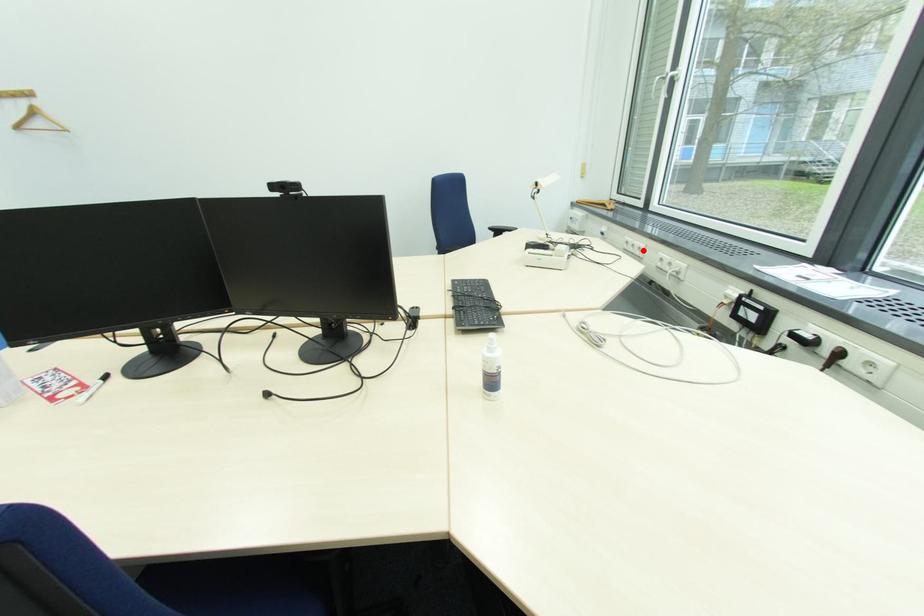
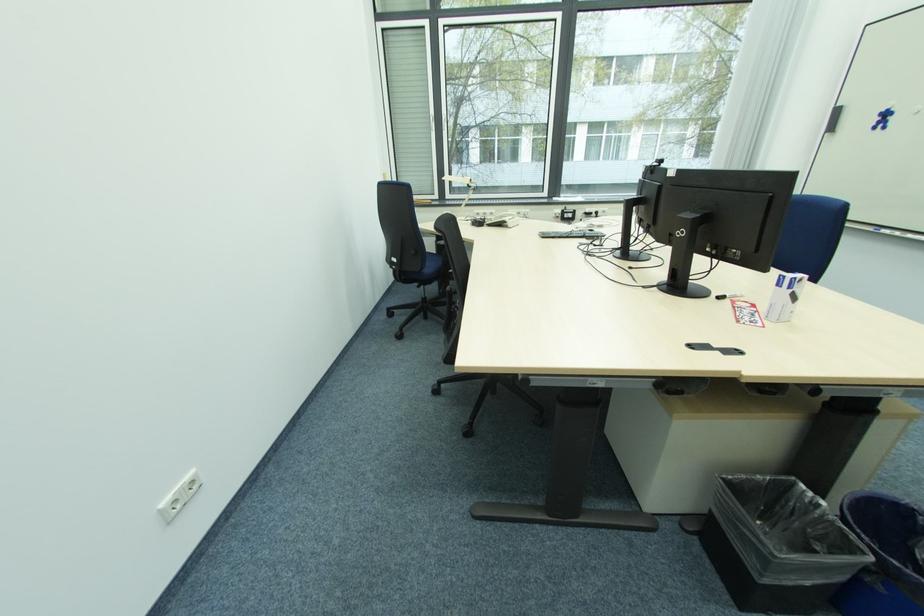
Find the pixel in the second image that matches the highlighted location in the first image.

(494, 216)